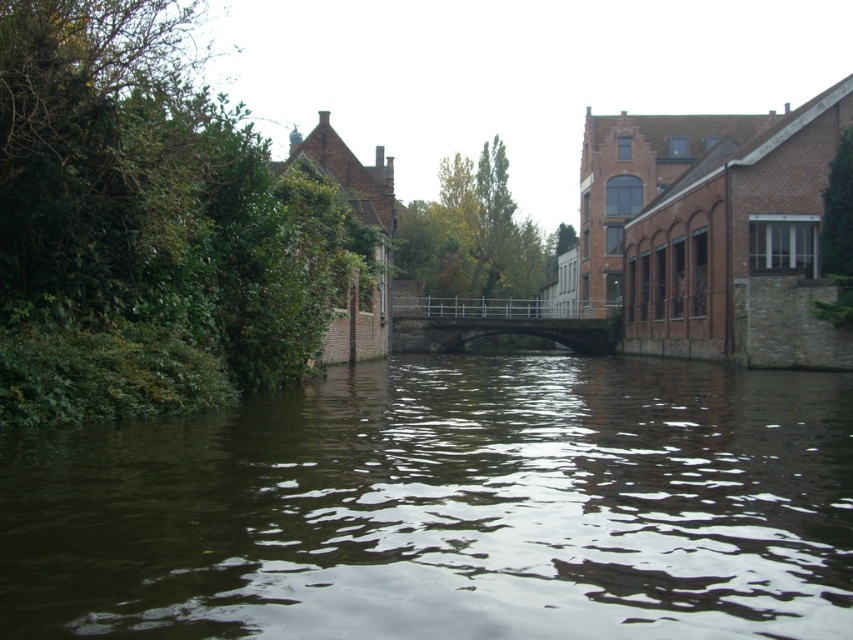
You are standing at the edge of the canal and want to take a photo. There are two points in the scene marked as point 1 at coordinates point (57, 524) and point 2 at coordinates point (448, 305). Which point will appear larger in your photo?

Point 1 at coordinates point (57, 524) will appear larger in the photo because it is closer to the camera than point 2 at coordinates point (448, 305).

You are a tourist standing on the left side of the canal and want to cross to the right side. The metallic gray bridge at center is the only crossing point. Can you see the brown water at center from your current position? Explain why or why not based on the scene description.

Yes, you can see the brown water at center from your current position because the metallic gray bridge at center is positioned above the brown water at center, allowing the water to be visible beneath it.